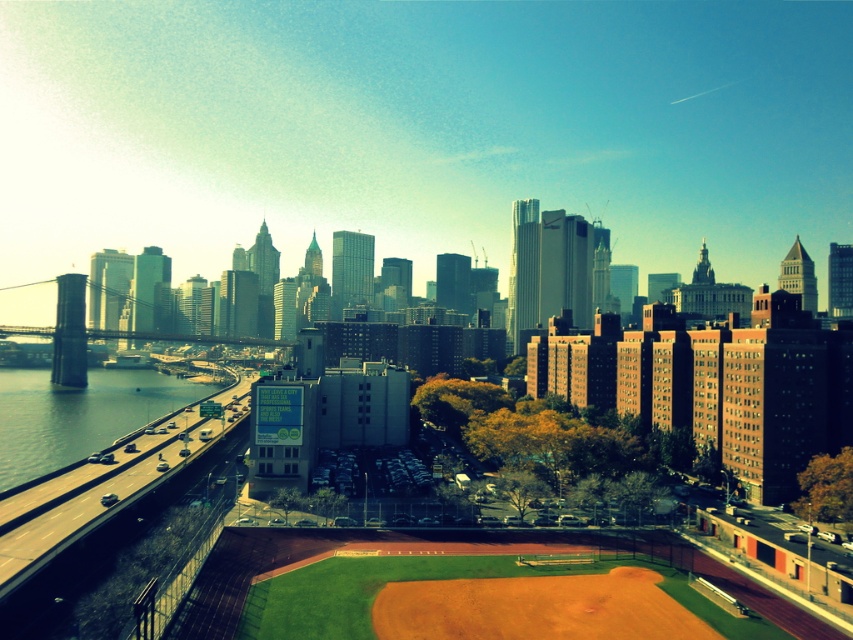
You are a surveyor tasked with assessing the elevation changes in this area. Based on the image, which object, the brown dirt field at center or the clear water at bridge left, is higher in elevation?

The brown dirt field at center is taller than clear water at bridge left, meaning it has a higher elevation.

You are standing at the baseball field and want to walk to the point that is closer to you. Which point should you head towards, point [323,396] or point [44,394]?

You should head towards point [323,396] because it is closer to the viewer than point [44,394].